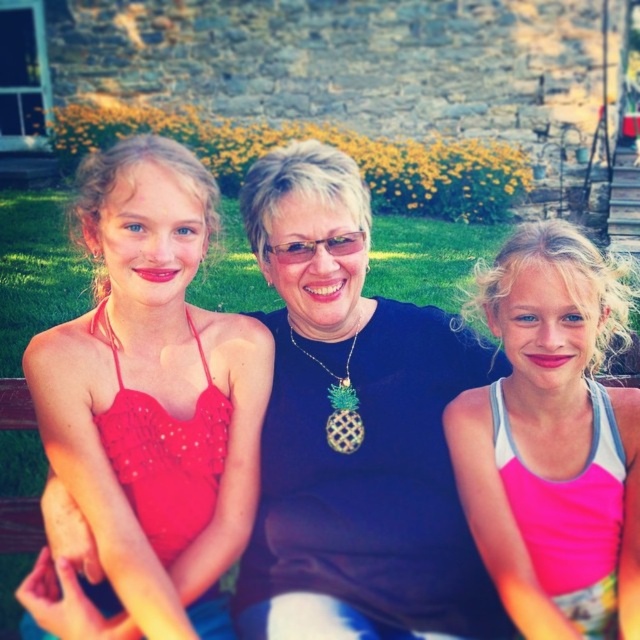
Question: Can you confirm if matte red dress at left is positioned below pink fabric tank top at center?

Choices:
 (A) yes
 (B) no

Answer: (A)

Question: Does matte red dress at left appear on the left side of pink fabric tank top at center?

Choices:
 (A) yes
 (B) no

Answer: (A)

Question: Considering the relative positions of matte red dress at left and pink fabric tank top at center in the image provided, where is matte red dress at left located with respect to pink fabric tank top at center?

Choices:
 (A) left
 (B) right

Answer: (A)